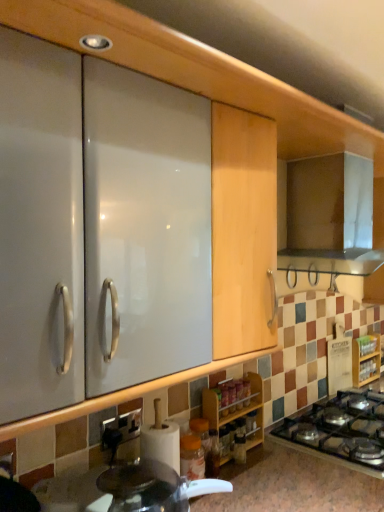
Question: From a real-world perspective, is wooden spice rack at lower right, which is the 1th cabinetry in back-to-front order, physically above white glossy countertop at lower center?

Choices:
 (A) yes
 (B) no

Answer: (A)

Question: From the image's perspective, is wooden spice rack at lower right, which is the 2th cabinetry from front to back, located above white glossy countertop at lower center?

Choices:
 (A) no
 (B) yes

Answer: (B)

Question: Could you tell me if wooden spice rack at lower right, which is the 1th cabinetry in back-to-front order, is turned towards white glossy countertop at lower center?

Choices:
 (A) no
 (B) yes

Answer: (A)

Question: Does wooden spice rack at lower right, which is the 2th cabinetry from front to back, have a lesser width compared to white glossy countertop at lower center?

Choices:
 (A) yes
 (B) no

Answer: (A)

Question: Which is correct: black glass gas stove at lower right is inside wooden spice rack at lower right, which appears as the 2th cabinetry when viewed from the left, or outside of it?

Choices:
 (A) outside
 (B) inside

Answer: (A)

Question: From the image's perspective, is black glass gas stove at lower right above or below wooden spice rack at lower right, which is the 2th cabinetry from front to back?

Choices:
 (A) above
 (B) below

Answer: (B)

Question: Would you say black glass gas stove at lower right is to the left or to the right of wooden spice rack at lower right, which is the 2th cabinetry from front to back, in the picture?

Choices:
 (A) left
 (B) right

Answer: (A)

Question: Is black glass gas stove at lower right bigger or smaller than wooden spice rack at lower right, which appears as the 2th cabinetry when viewed from the left?

Choices:
 (A) big
 (B) small

Answer: (A)

Question: From the image's perspective, is wooden spice rack at lower right, which appears as the 2th cabinetry when viewed from the left, above or below black glass gas stove at lower right?

Choices:
 (A) below
 (B) above

Answer: (B)

Question: Does point (375, 342) appear closer or farther from the camera than point (350, 435)?

Choices:
 (A) farther
 (B) closer

Answer: (A)

Question: Is wooden spice rack at lower right, which appears as the 1th cabinetry when viewed from the right, in front of or behind black glass gas stove at lower right in the image?

Choices:
 (A) front
 (B) behind

Answer: (B)

Question: From a real-world perspective, relative to black glass gas stove at lower right, is wooden spice rack at lower right, which appears as the 2th cabinetry when viewed from the left, vertically above or below?

Choices:
 (A) above
 (B) below

Answer: (A)

Question: Is metallic silver range hood at upper right bigger or smaller than black glass gas stove at lower right?

Choices:
 (A) small
 (B) big

Answer: (B)

Question: From a real-world perspective, is metallic silver range hood at upper right positioned above or below black glass gas stove at lower right?

Choices:
 (A) above
 (B) below

Answer: (A)